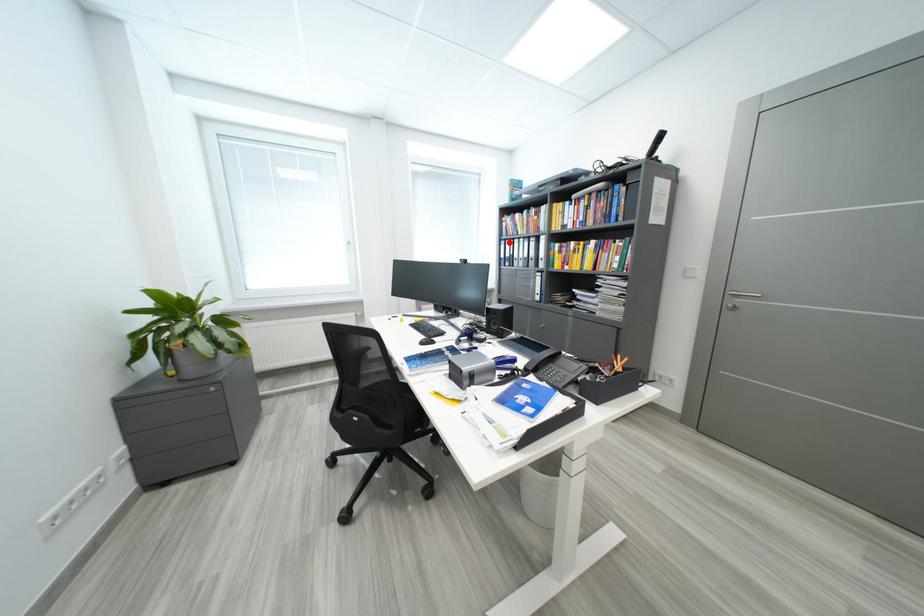
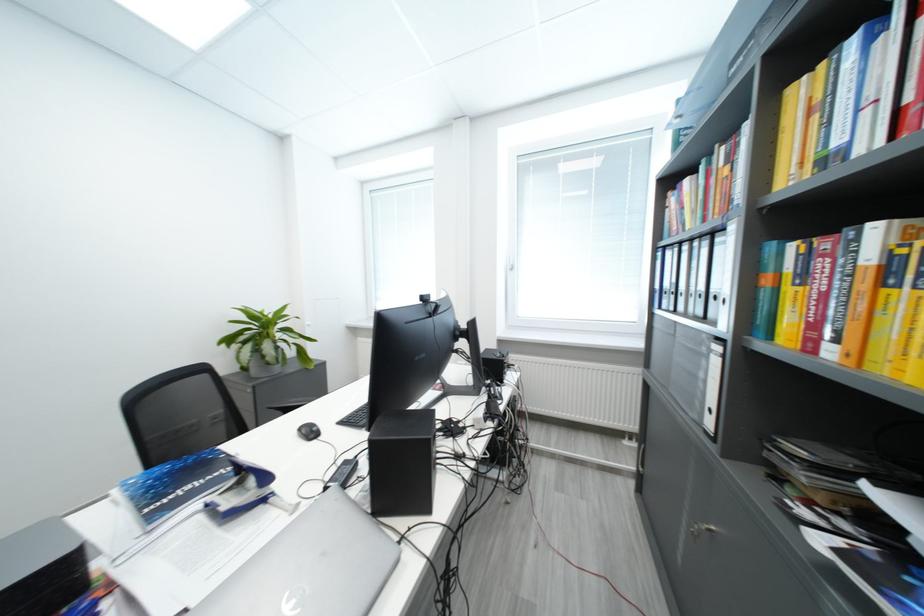
Question: A red point is marked in image1. In image2, is the corresponding 3D point closer to the camera or farther? Reply with the corresponding letter.

Choices:
 (A) The corresponding 3D point is closer.
 (B) The corresponding 3D point is farther.

Answer: (B)